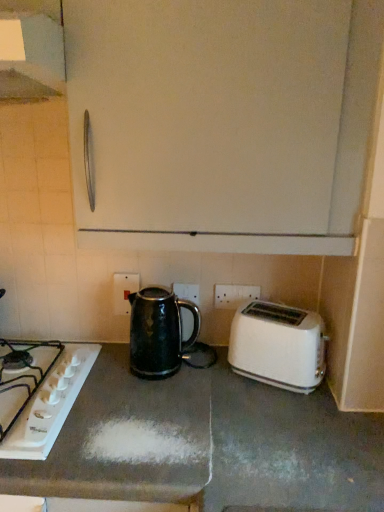
You are a GUI agent. You are given a task and a screenshot of the screen. Output one action in this format:
    pyautogui.click(x=<x>, y=<y>)
    Task: Click on the free space in front of white plastic toaster at lower right
    The height and width of the screenshot is (512, 384).
    Given the screenshot: What is the action you would take?
    pyautogui.click(x=283, y=416)